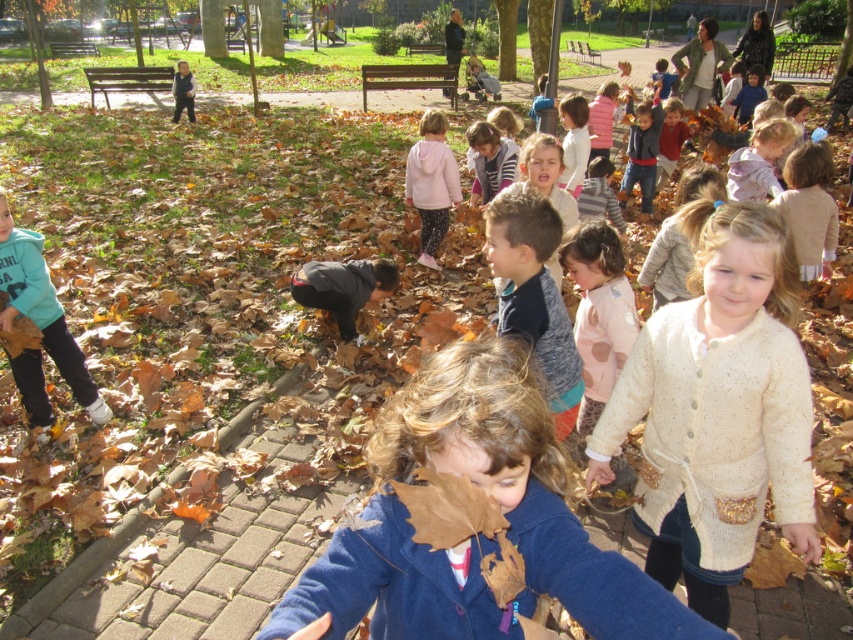
Is blue woolen jacket at center above matte teal hoodie at lower left?

Incorrect, blue woolen jacket at center is not positioned above matte teal hoodie at lower left.

Does blue woolen jacket at center have a larger size compared to matte teal hoodie at lower left?

Incorrect, blue woolen jacket at center is not larger than matte teal hoodie at lower left.

Where is `blue woolen jacket at center`? The width and height of the screenshot is (853, 640). blue woolen jacket at center is located at coordinates (473, 524).

Image resolution: width=853 pixels, height=640 pixels. What do you see at coordinates (473, 524) in the screenshot?
I see `blue woolen jacket at center` at bounding box center [473, 524].

Who is shorter, blue woolen jacket at center or pink fleece jacket at center?

With less height is blue woolen jacket at center.

Which is behind, point (517, 536) or point (434, 214)?

The point (434, 214) is behind.

In order to click on blue woolen jacket at center in this screenshot , I will do `click(473, 524)`.

In the scene shown: How far apart are white knitted sweater at center and pink fleece jacket at center?

white knitted sweater at center is 13.94 feet away from pink fleece jacket at center.

Does white knitted sweater at center appear on the right side of pink fleece jacket at center?

Correct, you'll find white knitted sweater at center to the right of pink fleece jacket at center.

This screenshot has width=853, height=640. What do you see at coordinates (718, 408) in the screenshot? I see `white knitted sweater at center` at bounding box center [718, 408].

Where is `white knitted sweater at center`? white knitted sweater at center is located at coordinates pos(718,408).